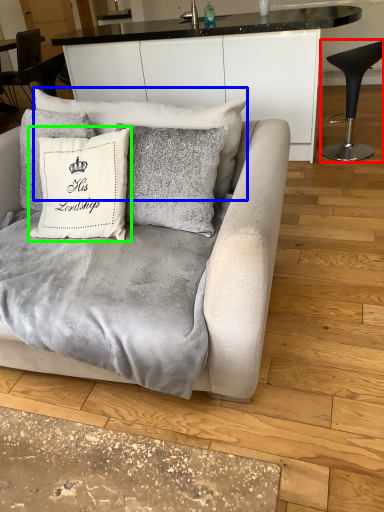
Question: Based on their relative distances, which object is nearer to chair (highlighted by a red box)? Choose from pillow (highlighted by a blue box) and pillow (highlighted by a green box).

Choices:
 (A) pillow
 (B) pillow

Answer: (A)